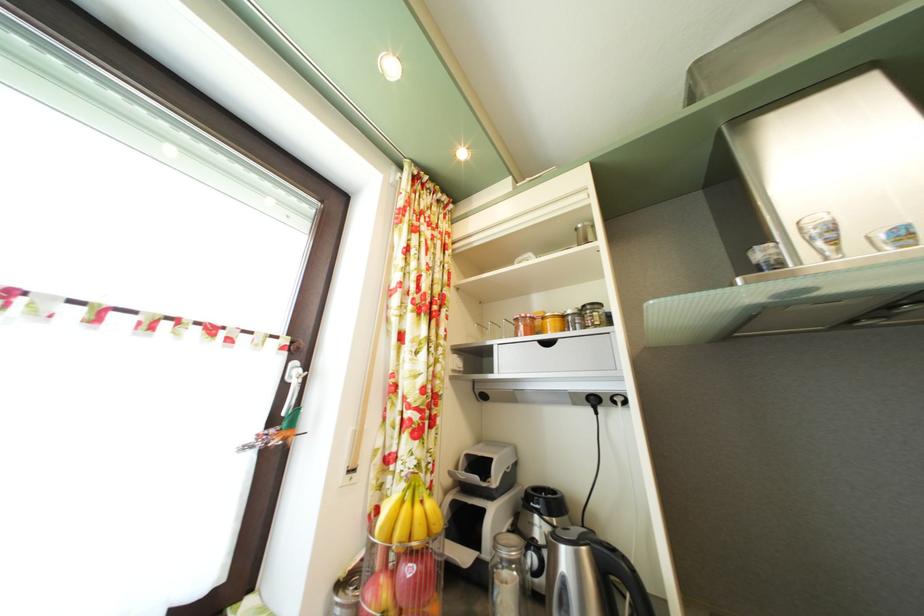
This screenshot has height=616, width=924. Describe the element at coordinates (546, 342) in the screenshot. I see `the drawer handle cutout` at that location.